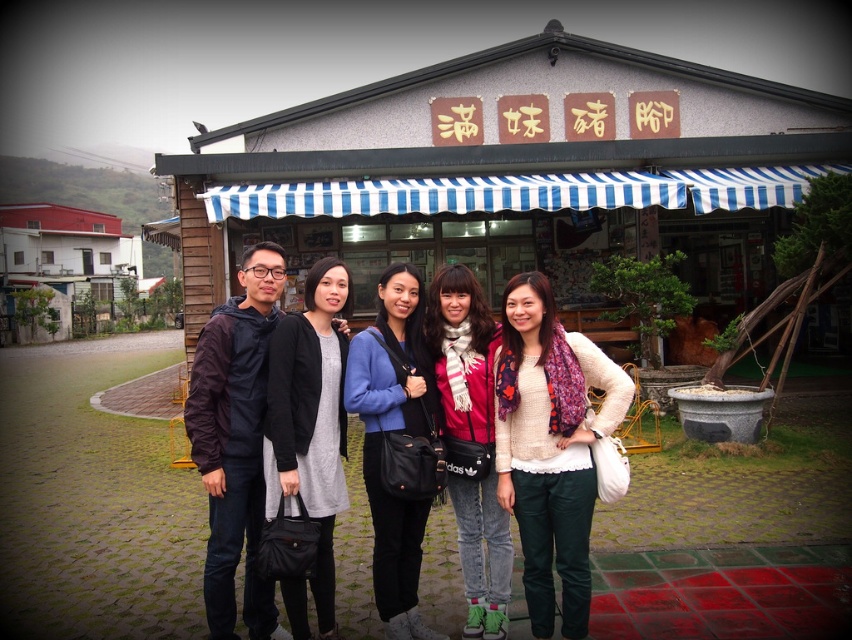
You are trying to decide whether to wear the red scarf at center under the white knitted sweater at center. Based on the image, is this possible?

The white knitted sweater at center is positioned over the red scarf at center in the image, so yes, it is possible to wear the red scarf at center under the white knitted sweater at center.

You are a photographer trying to arrange the group so that the white knitted sweater at center and the matte black bag at center are visible in the photo. According to the current arrangement, which object is positioned to the right side of the other?

The white knitted sweater at center is to the right of the matte black bag at center, so in the current arrangement, the white knitted sweater at center is positioned to the right of the matte black bag at center.